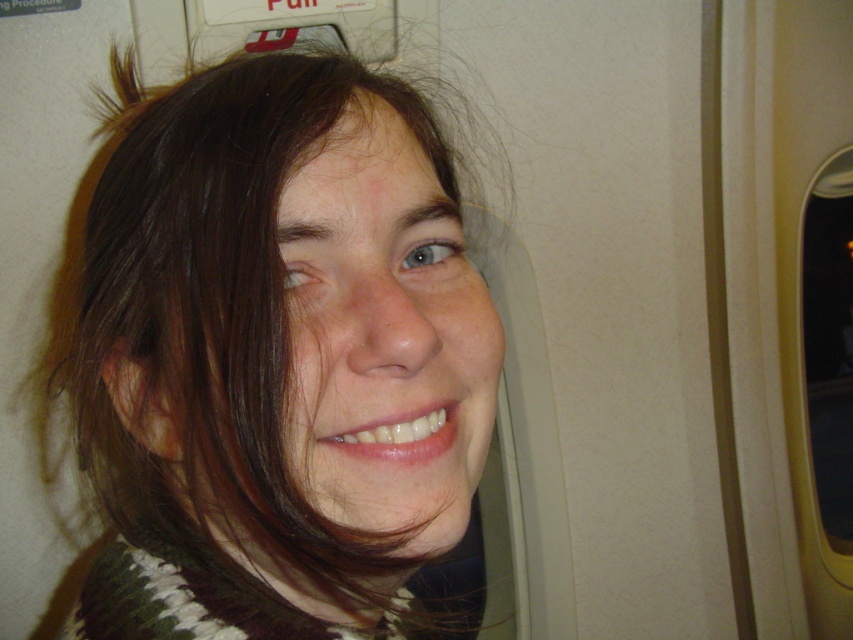
Is dark brown hair at center smaller than transparent glass airplane window at right?

Indeed, dark brown hair at center has a smaller size compared to transparent glass airplane window at right.

Who is shorter, dark brown hair at center or transparent glass airplane window at right?

With less height is dark brown hair at center.

At what (x,y) coordinates should I click in order to perform the action: click on dark brown hair at center. Please return your answer as a coordinate pair (x, y). This screenshot has height=640, width=853. Looking at the image, I should click on (276, 355).